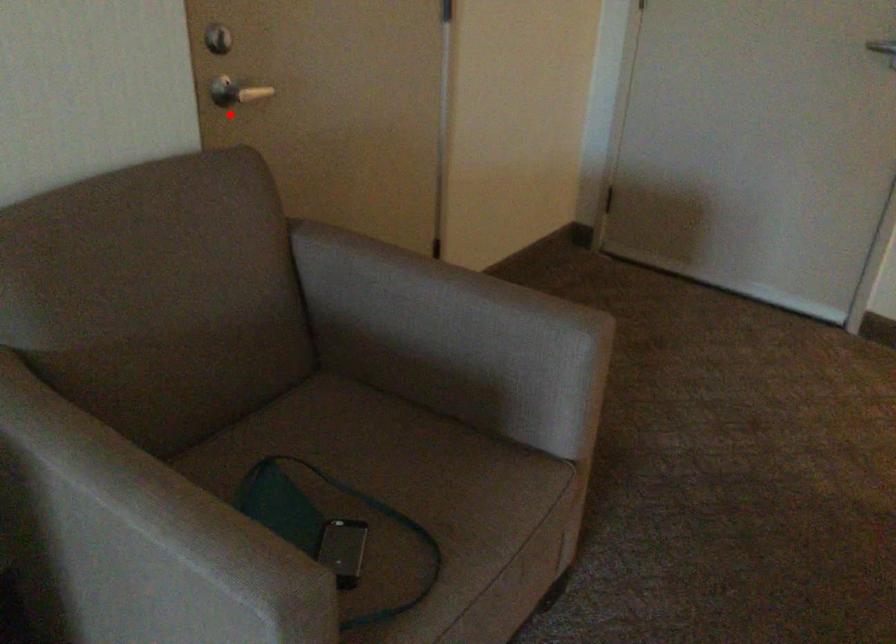
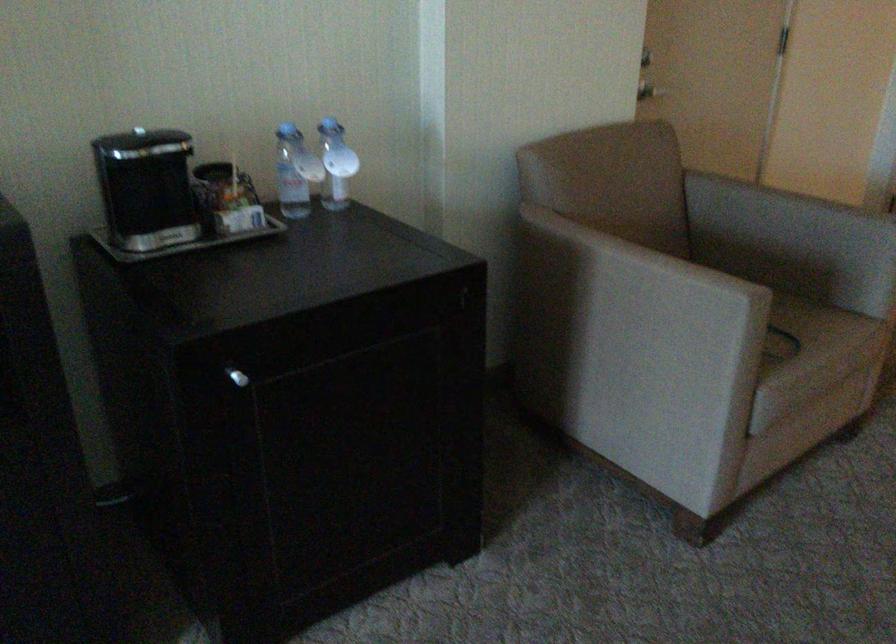
In the second image, find the point that corresponds to the highlighted location in the first image.

(649, 90)